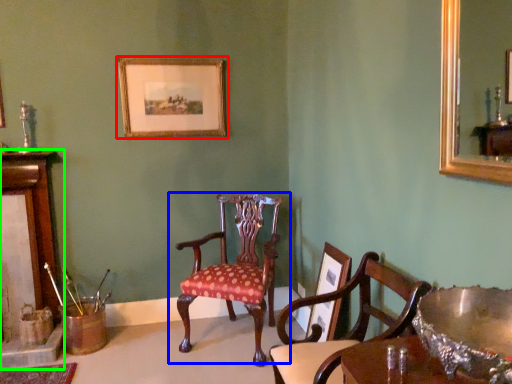
Question: Based on their relative distances, which object is nearer to picture frame (highlighted by a red box)? Choose from chair (highlighted by a blue box) and fireplace (highlighted by a green box).

Choices:
 (A) chair
 (B) fireplace

Answer: (A)